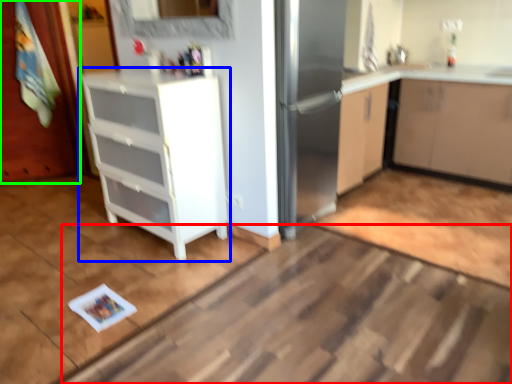
Question: Which is nearer to the plain (highlighted by a red box)? cabinetry (highlighted by a blue box) or door (highlighted by a green box).

Choices:
 (A) cabinetry
 (B) door

Answer: (A)